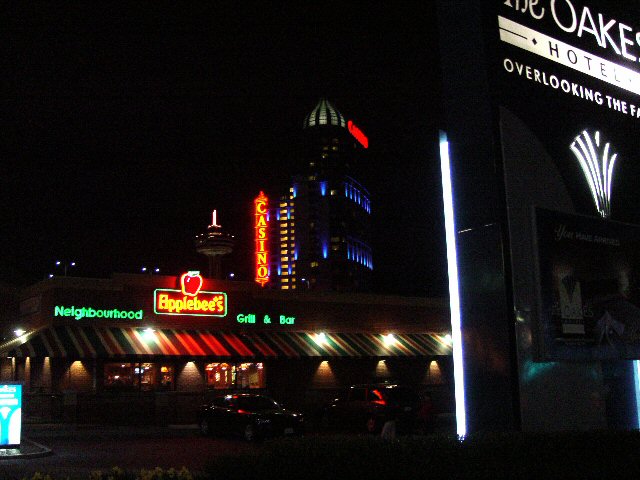
This screenshot has width=640, height=480. Identify the location of window. (368, 259).